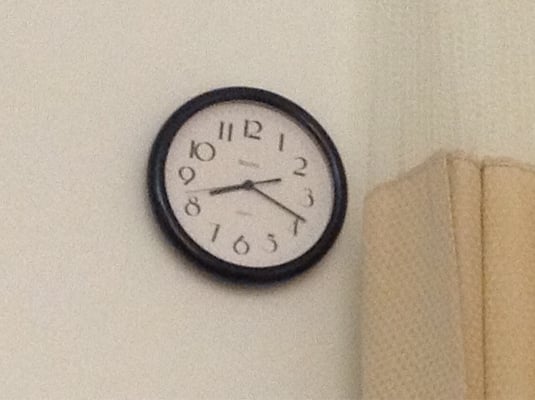
At what (x,y) coordinates should I click in order to perform the action: click on black round clock frame. Please return your answer as a coordinate pair (x, y). Looking at the image, I should click on (249, 278).